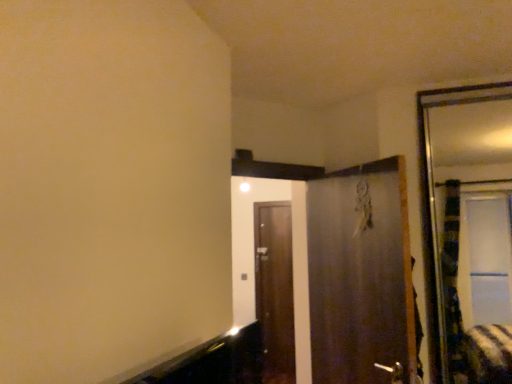
Question: Is brown wooden door at center, the second door positioned from the front, to the right of metallic silver door at center, arranged as the first door when viewed from the front, from the viewer's perspective?

Choices:
 (A) yes
 (B) no

Answer: (B)

Question: Does brown wooden door at center, the first door from the back, have a lesser height compared to metallic silver door at center, arranged as the second door when viewed from the back?

Choices:
 (A) no
 (B) yes

Answer: (A)

Question: From a real-world perspective, is brown wooden door at center, the second door positioned from the front, located beneath metallic silver door at center, arranged as the second door when viewed from the back?

Choices:
 (A) no
 (B) yes

Answer: (B)

Question: Does brown wooden door at center, the first door from the back, have a greater width compared to metallic silver door at center, arranged as the second door when viewed from the back?

Choices:
 (A) yes
 (B) no

Answer: (B)

Question: Is brown wooden door at center, the second door positioned from the front, thinner than metallic silver door at center, arranged as the second door when viewed from the back?

Choices:
 (A) yes
 (B) no

Answer: (A)

Question: Is point (396, 365) positioned closer to the camera than point (359, 294)?

Choices:
 (A) farther
 (B) closer

Answer: (B)

Question: Is silver metallic door handle at lower center inside or outside of metallic silver door at center, arranged as the first door when viewed from the front?

Choices:
 (A) outside
 (B) inside

Answer: (B)

Question: Considering the positions of silver metallic door handle at lower center and metallic silver door at center, arranged as the first door when viewed from the front, in the image, is silver metallic door handle at lower center taller or shorter than metallic silver door at center, arranged as the first door when viewed from the front,?

Choices:
 (A) short
 (B) tall

Answer: (A)

Question: Is silver metallic door handle at lower center bigger or smaller than metallic silver door at center, arranged as the first door when viewed from the front?

Choices:
 (A) small
 (B) big

Answer: (A)

Question: From a real-world perspective, is brown wooden door at center, the first door from the back, positioned above or below metallic silver door at center, arranged as the first door when viewed from the front?

Choices:
 (A) above
 (B) below

Answer: (B)

Question: Considering the positions of brown wooden door at center, the second door positioned from the front, and metallic silver door at center, arranged as the first door when viewed from the front, in the image, is brown wooden door at center, the second door positioned from the front, taller or shorter than metallic silver door at center, arranged as the first door when viewed from the front,?

Choices:
 (A) tall
 (B) short

Answer: (A)

Question: Is point (283, 334) closer or farther from the camera than point (338, 340)?

Choices:
 (A) closer
 (B) farther

Answer: (B)

Question: Is brown wooden door at center, the second door positioned from the front, inside the boundaries of metallic silver door at center, arranged as the second door when viewed from the back, or outside?

Choices:
 (A) inside
 (B) outside

Answer: (B)

Question: Looking at their shapes, would you say metallic silver door at center, arranged as the first door when viewed from the front, is wider or thinner than brown wooden door at center, the second door positioned from the front?

Choices:
 (A) thin
 (B) wide

Answer: (B)

Question: Do you think metallic silver door at center, arranged as the second door when viewed from the back, is within brown wooden door at center, the second door positioned from the front, or outside of it?

Choices:
 (A) outside
 (B) inside

Answer: (A)